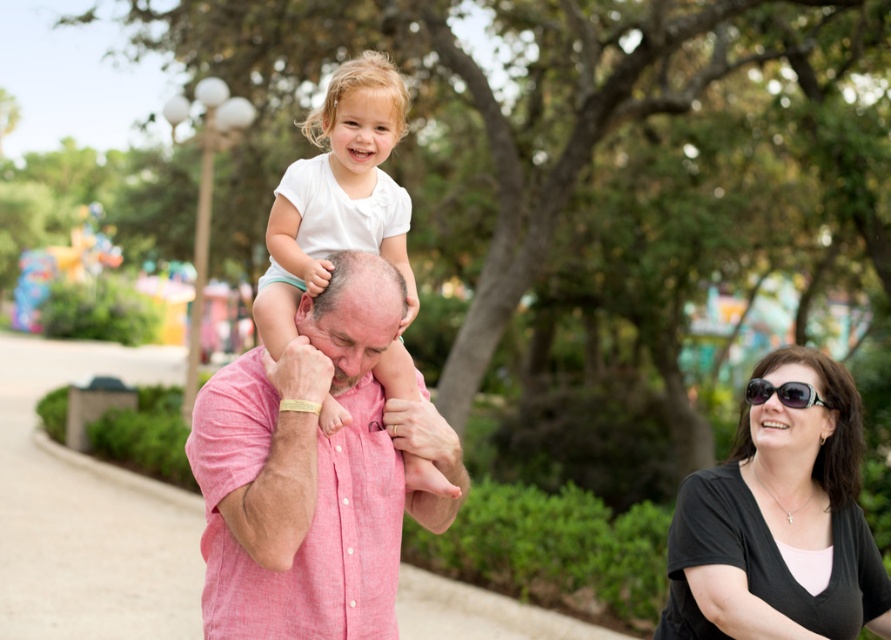
You are standing at the center of the image. Which direction should you move to locate the black matte shirt at lower right?

You should move to the lower right direction to locate the black matte shirt at lower right since it is positioned at point [778,518].

You are standing at the point labeled point (347, 100) and want to walk to the point labeled point (843, 557). Which direction should you move relative to the current position?

You should move backward because point (843, 557) is behind point (347, 100).

You are standing in the park scene and want to place a small decorative rock between the two points labeled point (816, 486) and point (822, 400). Which point should the rock be closer to in order to be nearer to the viewer?

The rock should be closer to point (816, 486) because it is further to the viewer than point (822, 400).